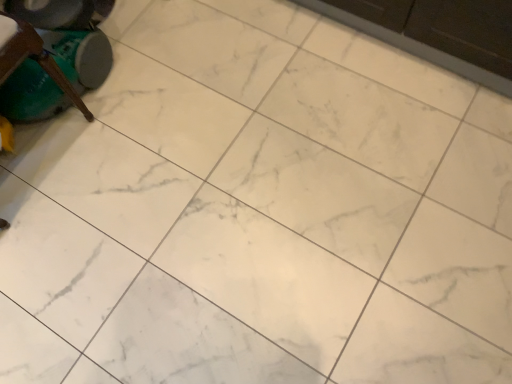
I want to click on wooden chair at left, so click(x=31, y=57).

This screenshot has width=512, height=384. What do you see at coordinates (31, 57) in the screenshot?
I see `wooden chair at left` at bounding box center [31, 57].

Find the location of `wooden chair at left`. wooden chair at left is located at coordinates (31, 57).